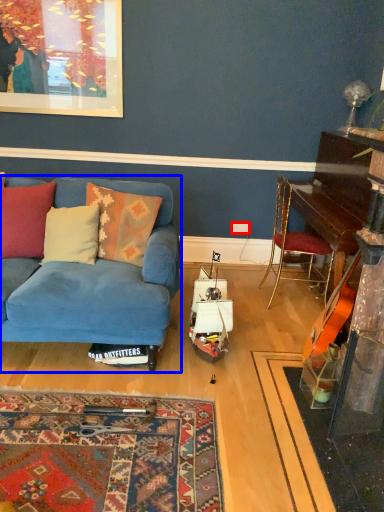
Question: Which object is further to the camera taking this photo, power outlet (highlighted by a red box) or studio couch (highlighted by a blue box)?

Choices:
 (A) power outlet
 (B) studio couch

Answer: (A)